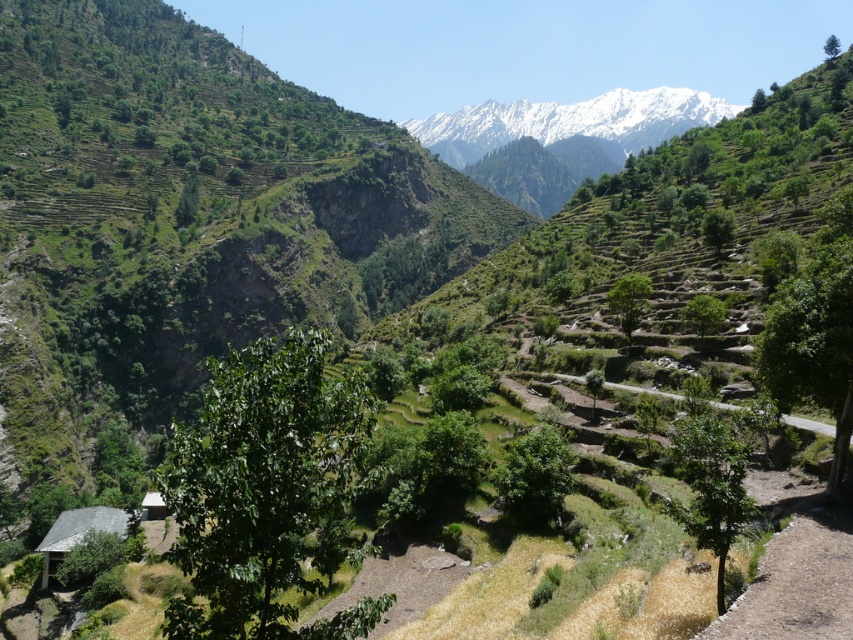
You are hiking and want to reach the gray slate hut at lower left and the white wooden hut at lower left. Which one is closer to you?

The gray slate hut at lower left is closer to the viewer than the white wooden hut at lower left.

You are a hiker carrying a backpack that is 18 feet wide. You come across two huts, the gray slate hut at lower left and the white wooden hut at lower left. Can your backpack fit through the space between them?

The gray slate hut at lower left and the white wooden hut at lower left are 20.12 feet apart from each other. Since your backpack is 18 feet wide, it can fit through the space between them.